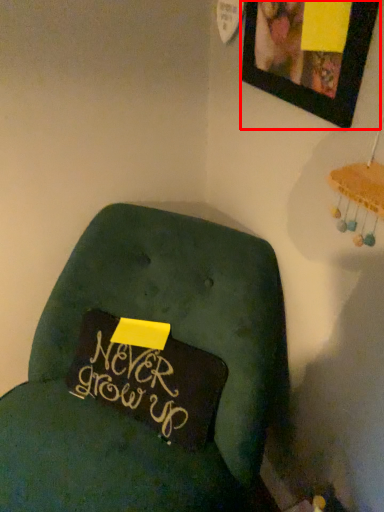
Question: In this image, where is picture frame (annotated by the red box) located relative to furniture?

Choices:
 (A) right
 (B) left

Answer: (A)